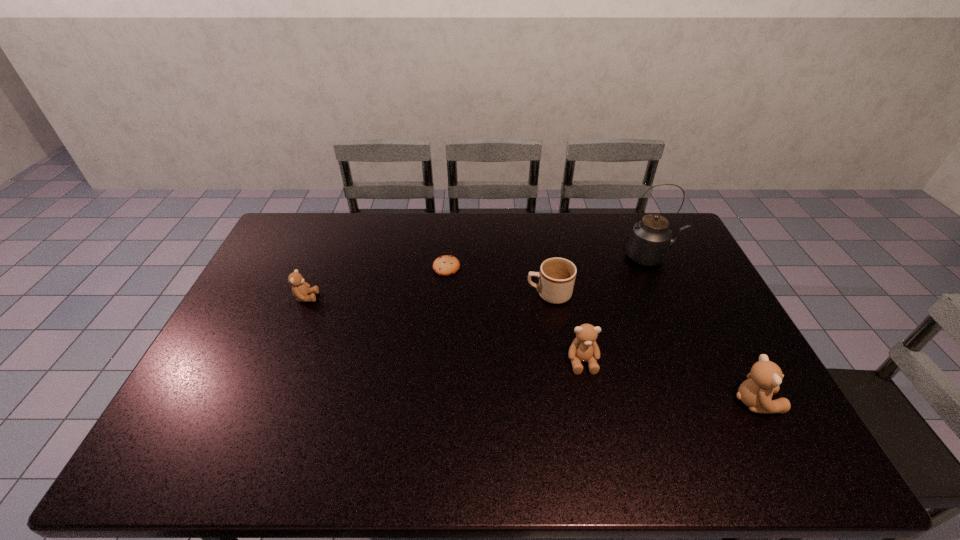
Find the location of a particular element. Image resolution: width=960 pixels, height=540 pixels. free region located 0.180m on the front-facing side of the shortest teddy bear is located at coordinates (373, 297).

Find the location of a particular element. vacant region located on the front-facing side of the second farthest teddy bear is located at coordinates (592, 408).

Identify the location of vacant space located 0.090m on the side of the mug with the handle. (498, 294).

You are a GUI agent. You are given a task and a screenshot of the screen. Output one action in this format:
    pyautogui.click(x=<x>, y=<y>)
    Task: Click on the free point located 0.400m on the side of the mug with the handle
    The width and height of the screenshot is (960, 540).
    Given the screenshot: What is the action you would take?
    pyautogui.click(x=402, y=294)

Identify the location of vacant region located on the side of the mug with the handle. This screenshot has height=540, width=960. (465, 294).

Locate an element on the screen. The height and width of the screenshot is (540, 960). vacant area situated on the left of the second object from left to right is located at coordinates (340, 267).

Locate an element on the screen. This screenshot has height=540, width=960. object that is at the far edge is located at coordinates (650, 239).

Identify the location of object located at the near edge. This screenshot has height=540, width=960. (763, 381).

The width and height of the screenshot is (960, 540). Identify the location of object that is positioned at the left edge. 300,289.

At what (x,y) coordinates should I click in order to perform the action: click on teddy bear present at the right edge. Please return your answer as a coordinate pair (x, y). Image resolution: width=960 pixels, height=540 pixels. Looking at the image, I should click on (763, 381).